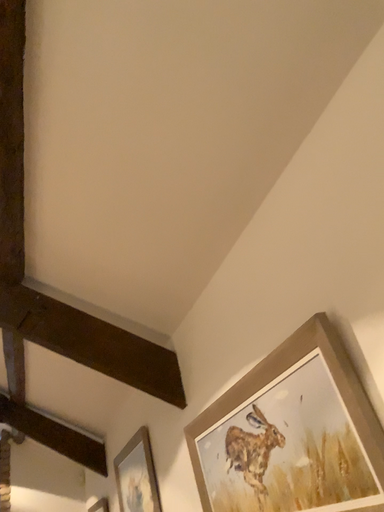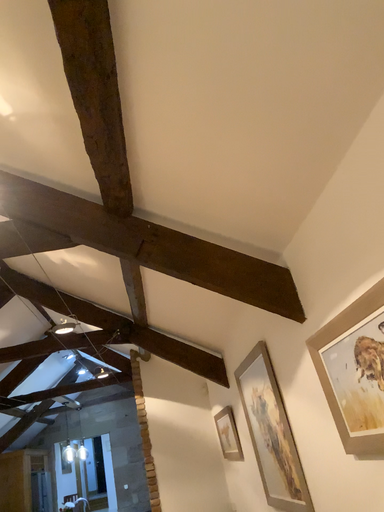
Question: Which way did the camera rotate in the video?

Choices:
 (A) rotated right
 (B) rotated left

Answer: (B)